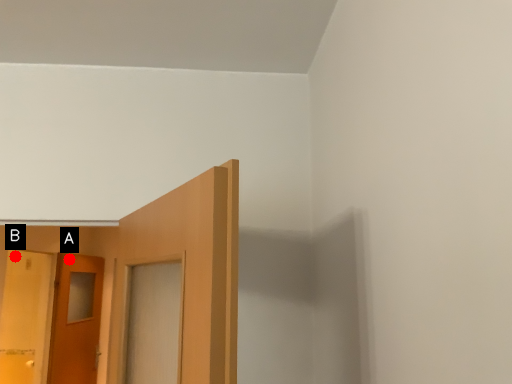
Question: Two points are circled on the image, labeled by A and B beside each circle. Which of the following is the closest to the observer?

Choices:
 (A) A is closer
 (B) B is closer

Answer: (A)